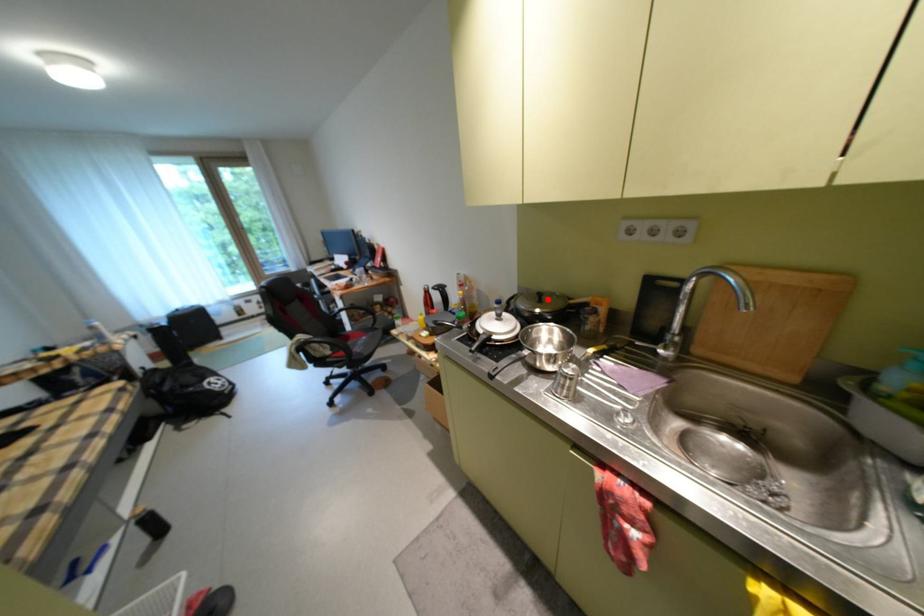
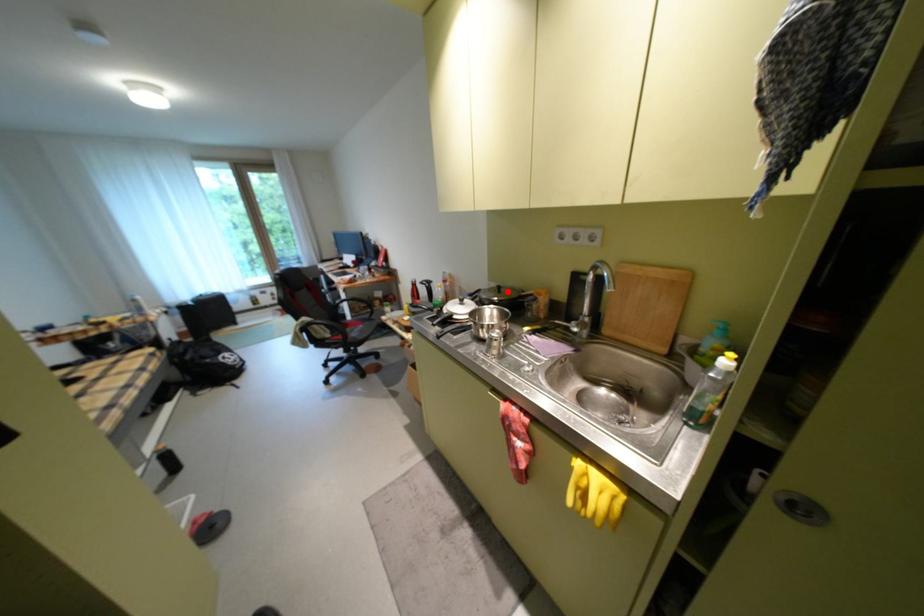
I am providing you with two images of the same scene from different viewpoints. A red point is marked on the first image and another point is marked on the second image. Is the red point in image1 aligned with the point shown in image2?

Yes